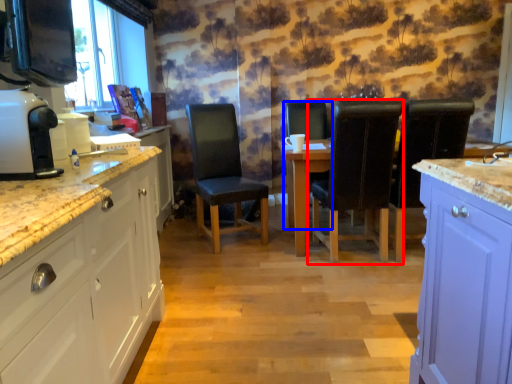
Question: Among these objects, which one is farthest to the camera, chair (highlighted by a red box) or chair (highlighted by a blue box)?

Choices:
 (A) chair
 (B) chair

Answer: (B)